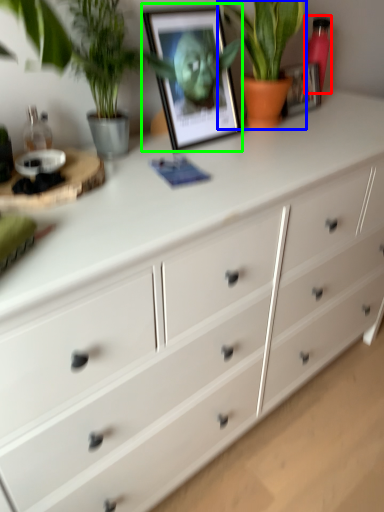
Question: Which object is the closest to the bottle (highlighted by a red box)? Choose among these: houseplant (highlighted by a blue box) or picture frame (highlighted by a green box).

Choices:
 (A) houseplant
 (B) picture frame

Answer: (A)